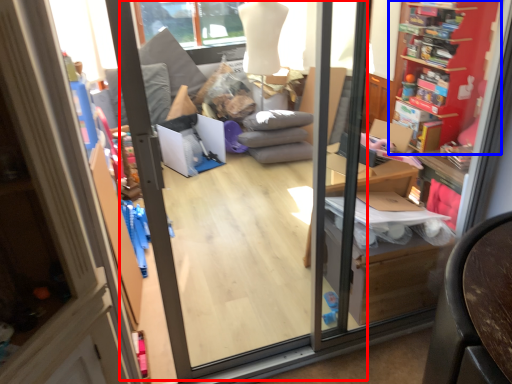
Question: Which point is further to the camera, screen door (highlighted by a red box) or shelf (highlighted by a blue box)?

Choices:
 (A) screen door
 (B) shelf

Answer: (B)